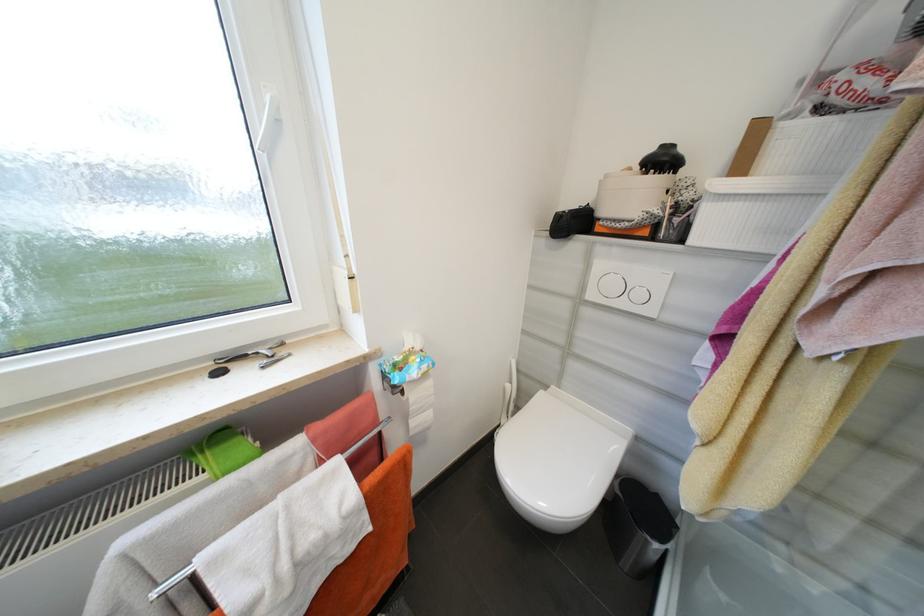
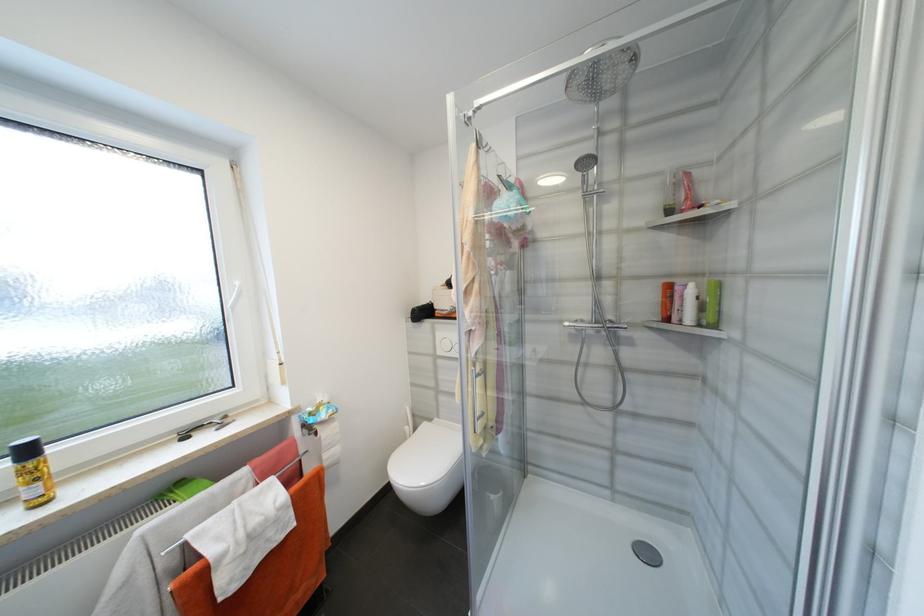
Find the pixel in the second image that matches point (578, 292) in the first image.

(436, 352)